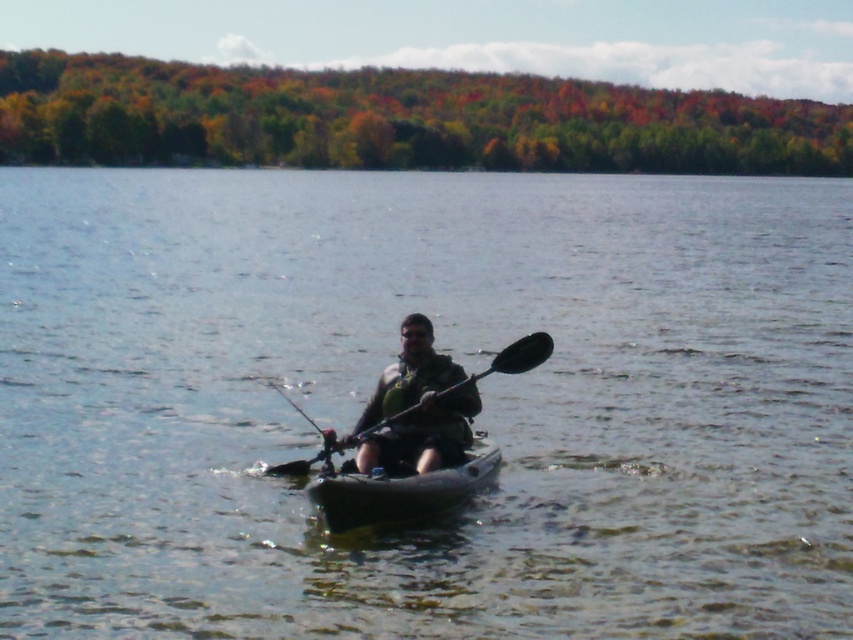
You are planning to store the camouflage fabric kayak at center and the black plastic paddle at center in a storage unit. The storage unit has a maximum width capacity of 1 meter. If the kayak is wider than the paddle, can both items be placed side by side without exceeding the width limit?

The camouflage fabric kayak at center is wider than the black plastic paddle at center. However, since the exact widths are not provided, it is impossible to determine if their combined width exceeds the 1 meter limit. Additional measurements are needed.